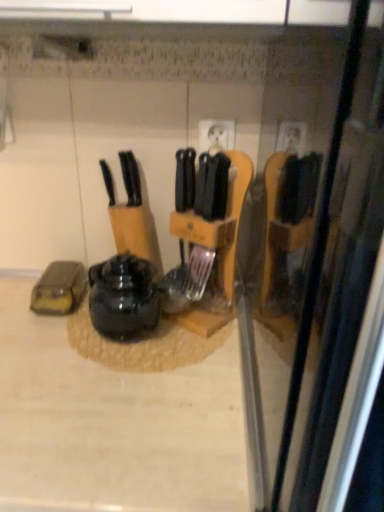
Question: From the image's perspective, would you say beige laminate counter at center is shown under shiny black kettle at center?

Choices:
 (A) no
 (B) yes

Answer: (B)

Question: Is beige laminate counter at center at the right side of shiny black kettle at center?

Choices:
 (A) yes
 (B) no

Answer: (B)

Question: Is beige laminate counter at center oriented away from shiny black kettle at center?

Choices:
 (A) yes
 (B) no

Answer: (B)

Question: Is beige laminate counter at center directly adjacent to shiny black kettle at center?

Choices:
 (A) no
 (B) yes

Answer: (A)

Question: Does beige laminate counter at center have a lesser height compared to shiny black kettle at center?

Choices:
 (A) no
 (B) yes

Answer: (A)

Question: From a real-world perspective, is beige laminate counter at center located higher than shiny black kettle at center?

Choices:
 (A) no
 (B) yes

Answer: (A)

Question: Considering the relative sizes of black plastic knife at center and shiny black kettle at center in the image provided, is black plastic knife at center bigger than shiny black kettle at center?

Choices:
 (A) no
 (B) yes

Answer: (A)

Question: Considering the relative positions of black plastic knife at center and shiny black kettle at center in the image provided, is black plastic knife at center in front of shiny black kettle at center?

Choices:
 (A) no
 (B) yes

Answer: (A)

Question: From a real-world perspective, is black plastic knife at center on shiny black kettle at center?

Choices:
 (A) yes
 (B) no

Answer: (A)

Question: From the image's perspective, is black plastic knife at center under shiny black kettle at center?

Choices:
 (A) no
 (B) yes

Answer: (A)

Question: Can you confirm if black plastic knife at center is positioned to the left of shiny black kettle at center?

Choices:
 (A) no
 (B) yes

Answer: (B)

Question: Is black plastic knife at center positioned far away from shiny black kettle at center?

Choices:
 (A) yes
 (B) no

Answer: (B)

Question: Can you confirm if shiny black kettle at center is positioned to the left of beige laminate counter at center?

Choices:
 (A) yes
 (B) no

Answer: (B)